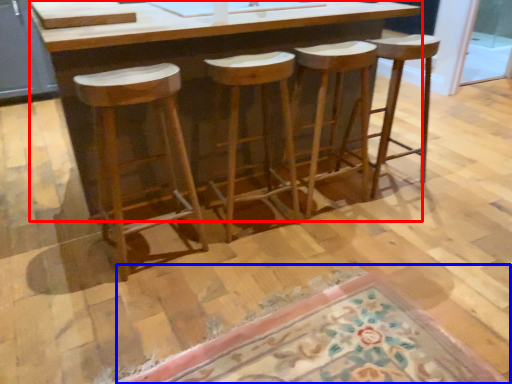
Question: Among these objects, which one is farthest to the camera, counter (highlighted by a red box) or doormat (highlighted by a blue box)?

Choices:
 (A) counter
 (B) doormat

Answer: (A)